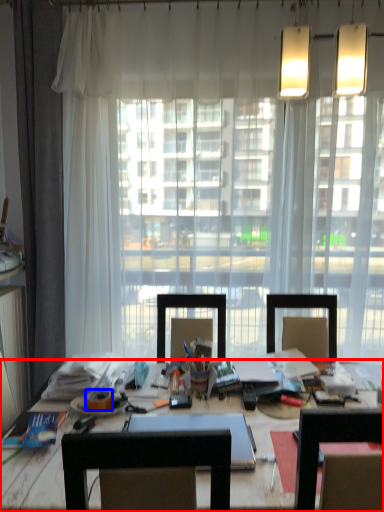
Question: Among these objects, which one is farthest to the camera, desk (highlighted by a red box) or adhesive tape (highlighted by a blue box)?

Choices:
 (A) desk
 (B) adhesive tape

Answer: (B)